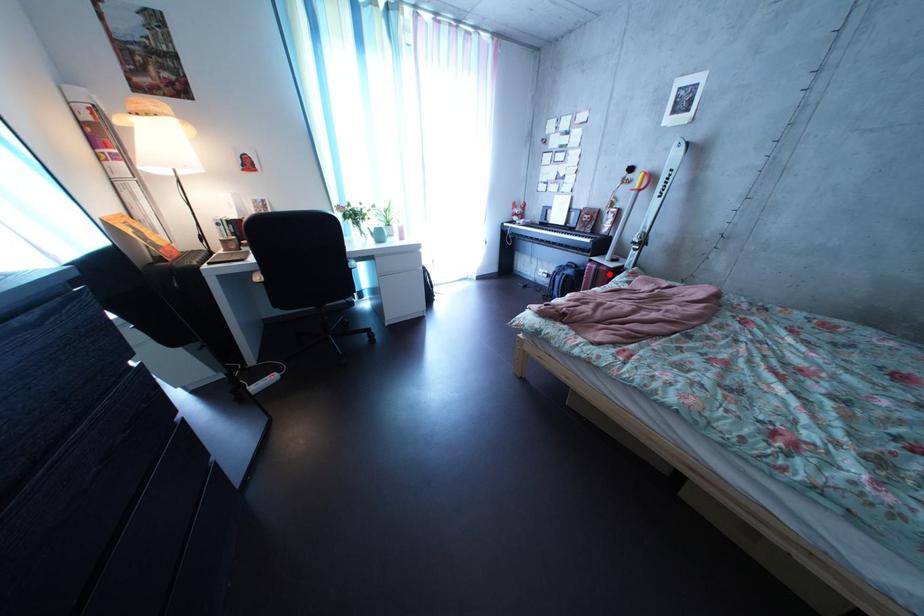
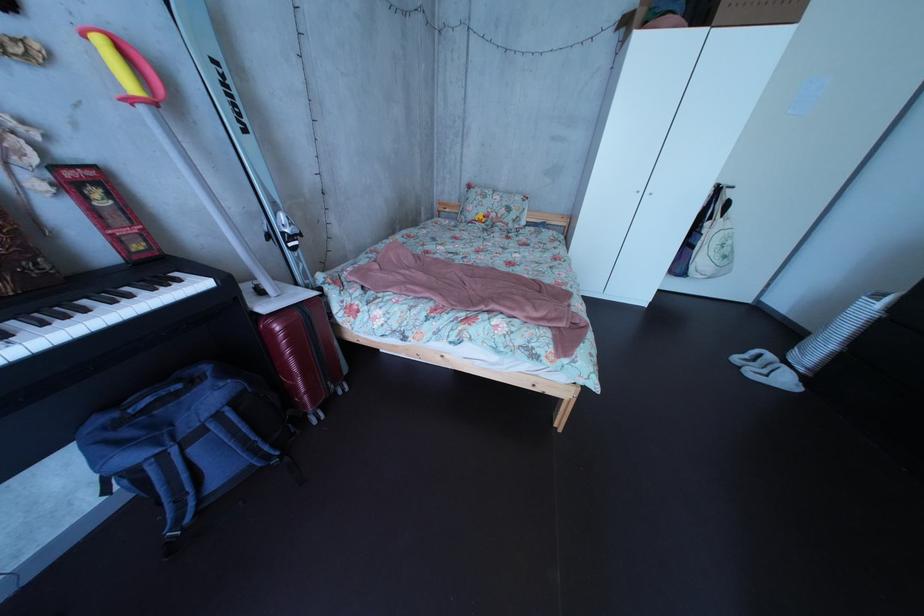
Locate, in the second image, the point that corresponds to the highlighted location in the first image.

(311, 322)